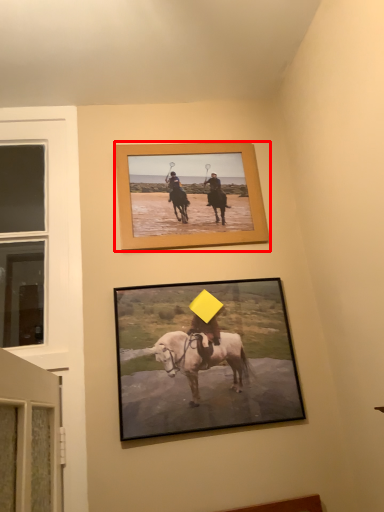
Question: From the image's perspective, where is picture frame (annotated by the red box) located relative to picture frame?

Choices:
 (A) above
 (B) below

Answer: (A)